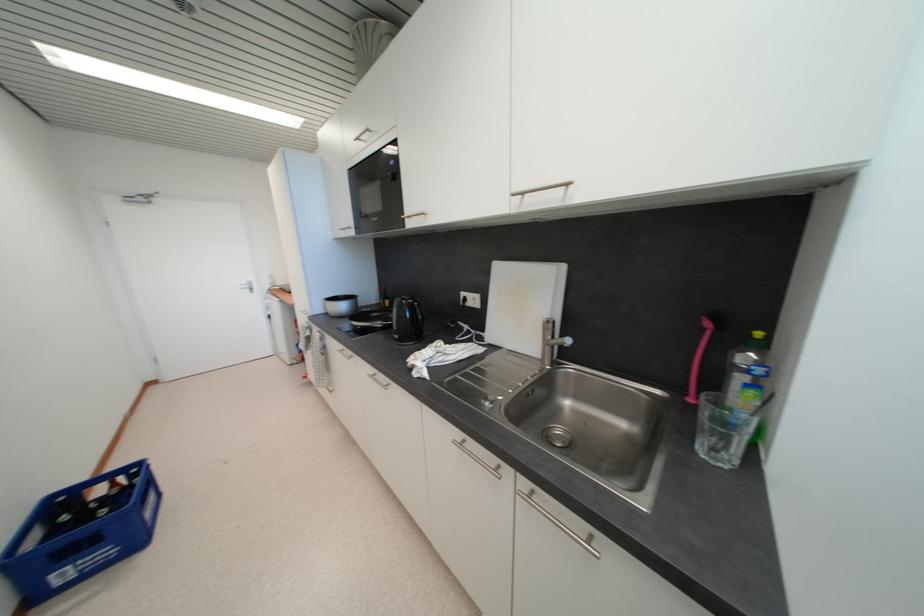
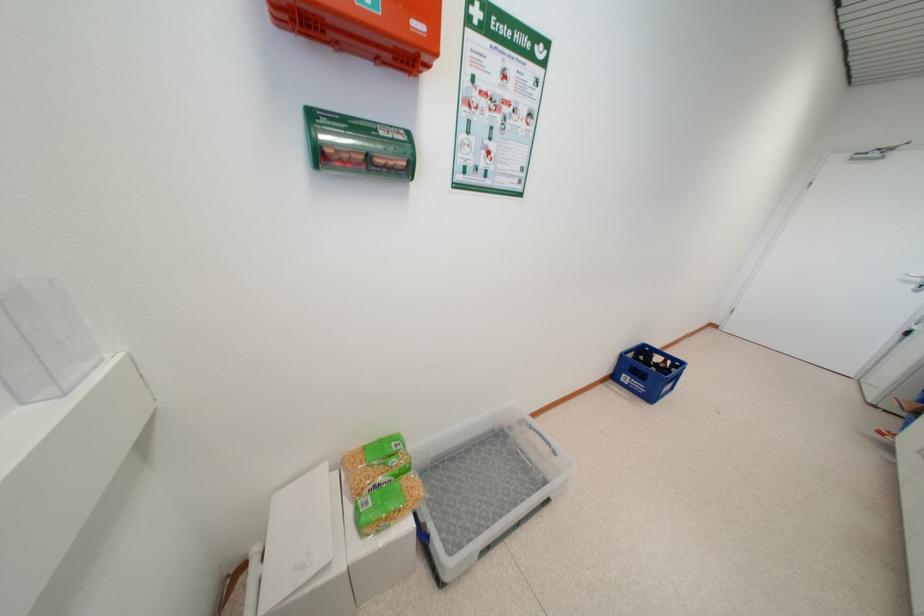
Where in the second image is the point corresponding to (118,487) from the first image?

(669, 363)